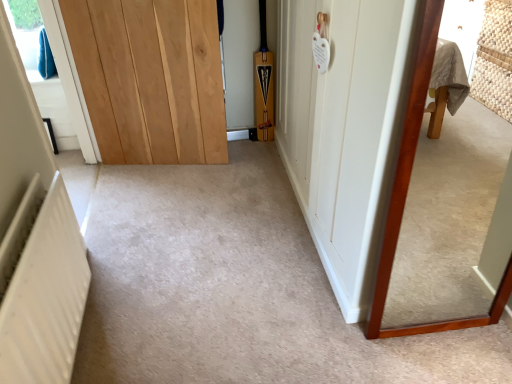
Question: Is white plastic radiator at lower left spatially inside white textured radiator at lower left, or outside of it?

Choices:
 (A) inside
 (B) outside

Answer: (B)

Question: Considering the relative positions of white plastic radiator at lower left and white textured radiator at lower left in the image provided, is white plastic radiator at lower left to the left or to the right of white textured radiator at lower left?

Choices:
 (A) right
 (B) left

Answer: (B)

Question: Based on their relative distances, which object is farther from the white plastic radiator at lower left?

Choices:
 (A) white textured radiator at lower left
 (B) light brown wood door at center, the 2th door from the right
 (C) wooden-framed mirror at right
 (D) white wood door at center, the first door from the right

Answer: (C)

Question: Estimate the real-world distances between objects in this image. Which object is closer to the white textured radiator at lower left?

Choices:
 (A) white wood door at center, which is the second door from left to right
 (B) light brown wood door at center, the 2th door from the right
 (C) wooden-framed mirror at right
 (D) white plastic radiator at lower left

Answer: (A)